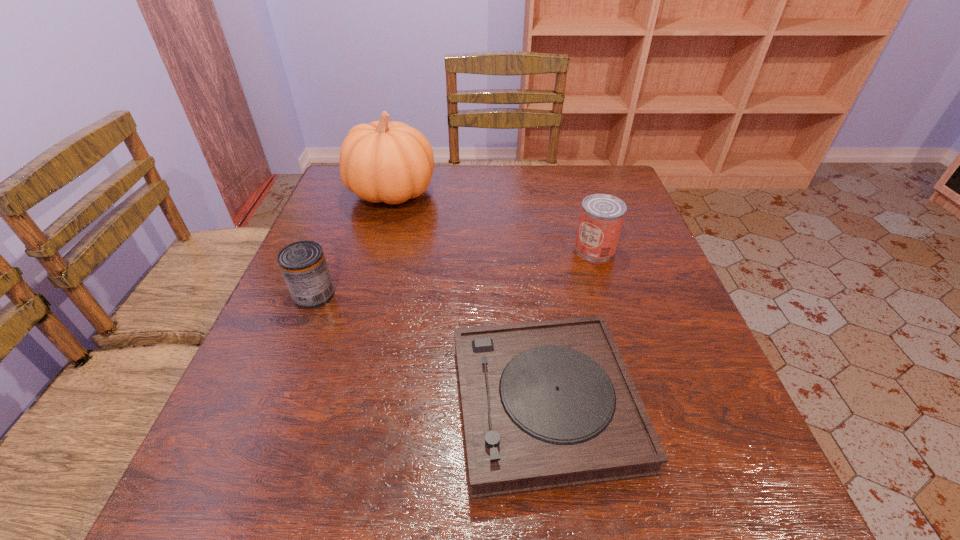
Identify the location of free location located 0.170m on the back of the nearer can. (338, 236).

Locate an element on the screen. vacant point located on the right of the shortest object is located at coordinates point(684,403).

In order to click on object that is at the far edge in this screenshot , I will do `click(392, 162)`.

Image resolution: width=960 pixels, height=540 pixels. In order to click on object that is at the near edge in this screenshot , I will do `click(550, 404)`.

Image resolution: width=960 pixels, height=540 pixels. Identify the location of pumpkin present at the left edge. (392, 162).

Identify the location of can present at the left edge. Image resolution: width=960 pixels, height=540 pixels. (303, 265).

Identify the location of can at the right edge. (601, 219).

This screenshot has height=540, width=960. What are the coordinates of `phonograph record at the right edge` in the screenshot? It's located at (550, 404).

At what (x,y) coordinates should I click in order to perform the action: click on object at the far left corner. Please return your answer as a coordinate pair (x, y). The image size is (960, 540). Looking at the image, I should click on (392, 162).

Where is `object at the near right corner`? This screenshot has height=540, width=960. object at the near right corner is located at coordinates (550, 404).